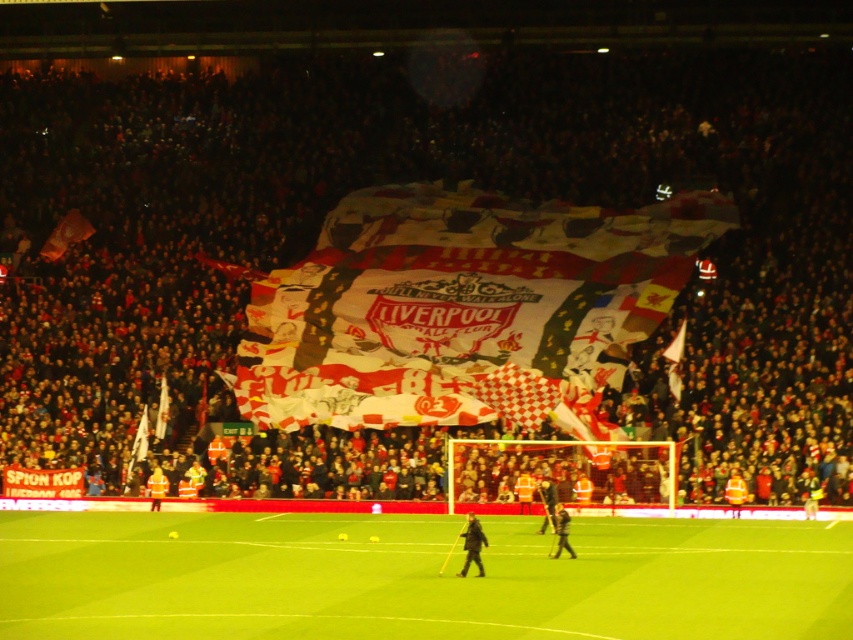
You are a photographer standing at the center of the pitch. You want to take a photo of two points marked on the field. The first point is at point (550, 486) and the second is at point (566, 531). Which point is closer to you?

Point (550, 486) is closer to you because it is further to the viewer than point (566, 531).

You are a photographer at the stadium and want to capture a photo of both the dark gray fabric at center and the dark gray uniform at center. Which object should you focus on first if you want to include both in the frame without zooming in or out?

The dark gray fabric at center is bigger than the dark gray uniform at center, so you should focus on the dark gray fabric at center first to ensure it fits in the frame before adjusting for the smaller dark gray uniform at center.